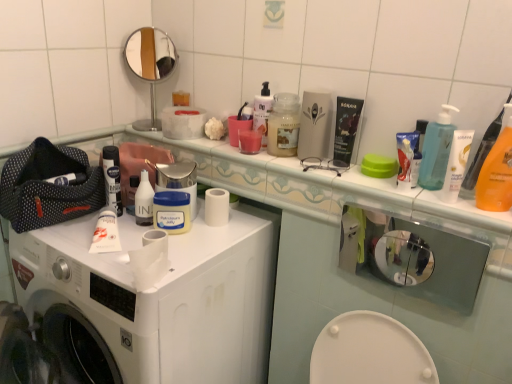
You are a GUI agent. You are given a task and a screenshot of the screen. Output one action in this format:
    pyautogui.click(x=<x>, y=<y>)
    Task: Click on the blank space to the left of white matte tube at center
    This screenshot has height=384, width=512.
    Given the screenshot: What is the action you would take?
    pyautogui.click(x=62, y=236)